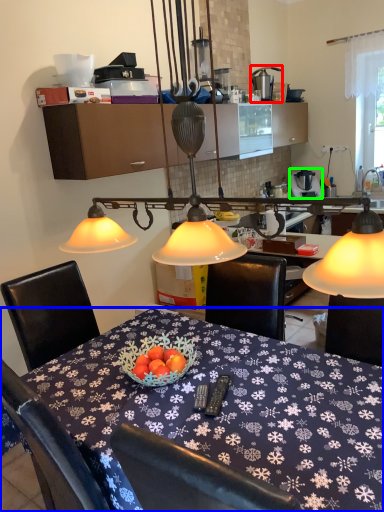
Question: Considering the real-world distances, which object is closest to tableware (highlighted by a red box)? desk (highlighted by a blue box) or appliance (highlighted by a green box).

Choices:
 (A) desk
 (B) appliance

Answer: (B)